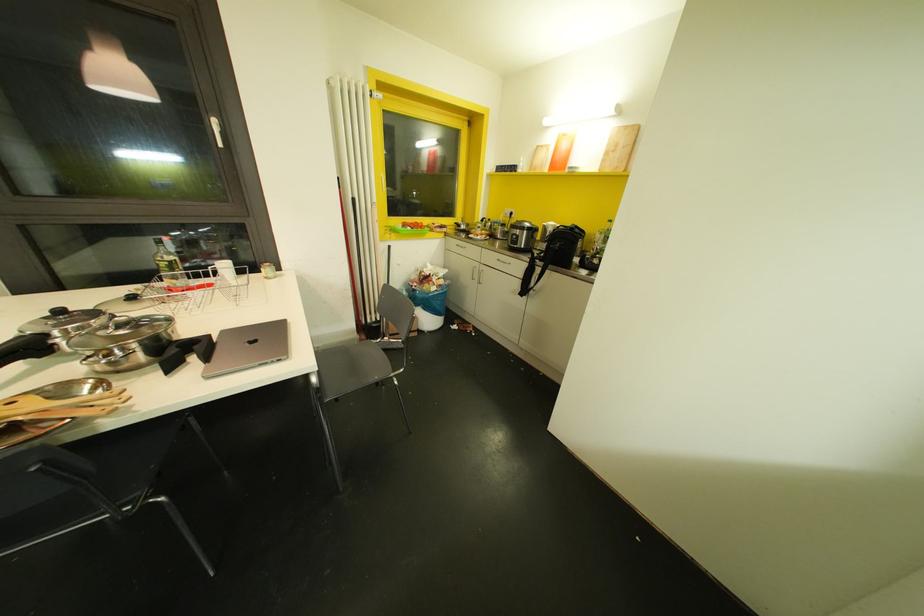
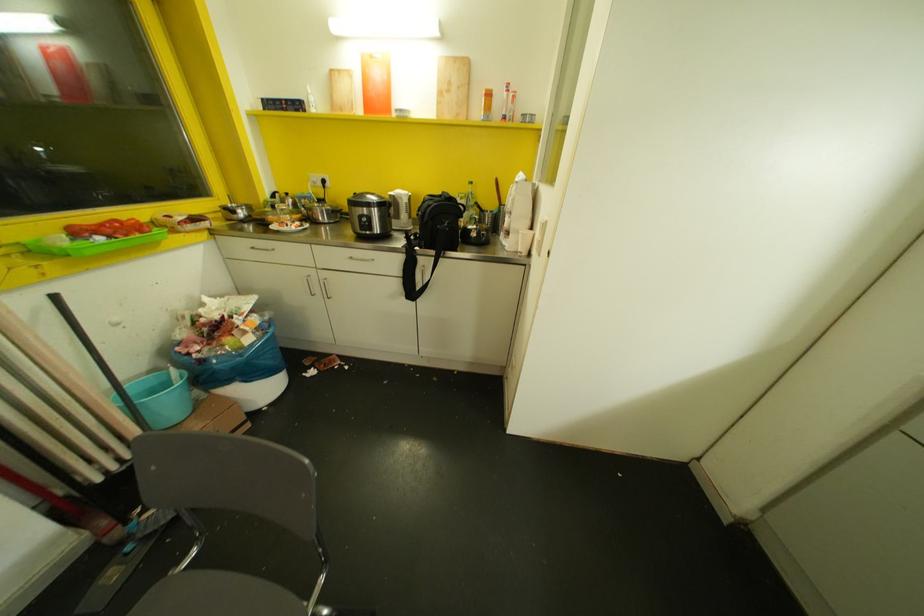
In the second image, find the point that corresponds to (388,246) in the first image.

(55, 296)